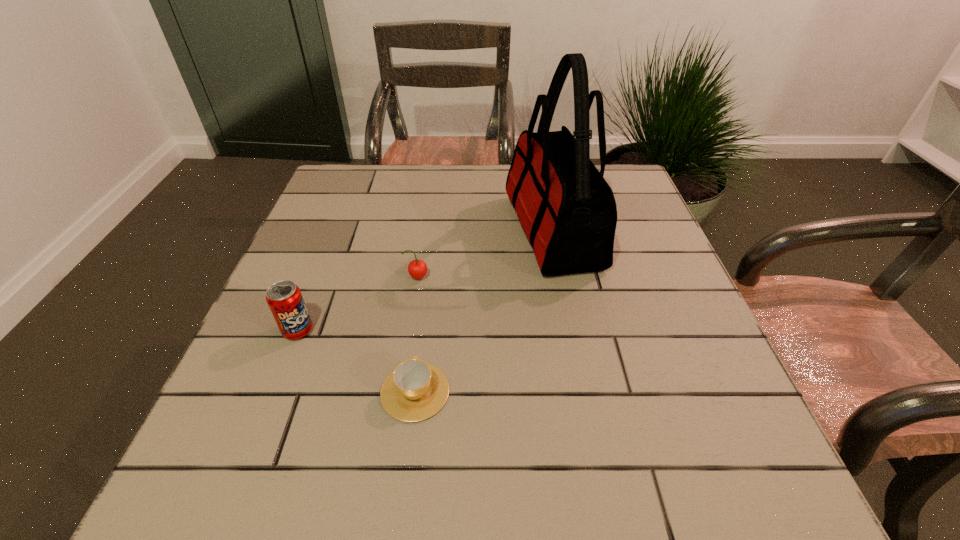
I want to click on the rightmost object, so click(567, 210).

You are a GUI agent. You are given a task and a screenshot of the screen. Output one action in this format:
    pyautogui.click(x=<x>, y=<y>)
    Task: Click on the duffel bag
    Image resolution: width=960 pixels, height=540 pixels.
    Given the screenshot: What is the action you would take?
    pyautogui.click(x=567, y=210)

The image size is (960, 540). I want to click on the leftmost object, so click(284, 298).

The width and height of the screenshot is (960, 540). Find the location of `soda can`. soda can is located at coordinates (284, 298).

This screenshot has height=540, width=960. Identify the location of the second shortest object. 417,269.

Image resolution: width=960 pixels, height=540 pixels. Find the location of `the nearest object`. the nearest object is located at coordinates (415, 390).

Find the location of a particular element. the shortest object is located at coordinates (415, 390).

I want to click on free region located on the back of the tallest object, so 541,177.

Where is `free space located on the front of the third farthest object`? free space located on the front of the third farthest object is located at coordinates (x=231, y=500).

At what (x,y) coordinates should I click in order to perform the action: click on free region located on the back of the third tallest object. Please return your answer as a coordinate pair (x, y). Looking at the image, I should click on (432, 185).